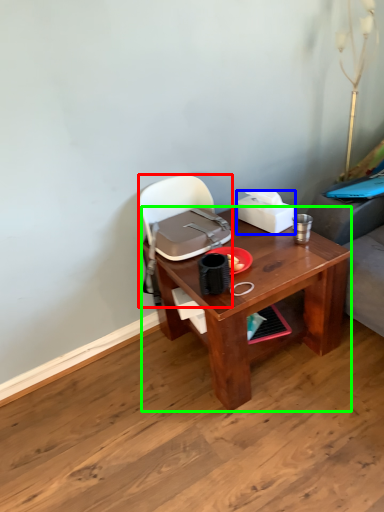
Question: Which object is the closest to the handbag (highlighted by a red box)? Choose among these: box (highlighted by a blue box) or desk (highlighted by a green box).

Choices:
 (A) box
 (B) desk

Answer: (A)